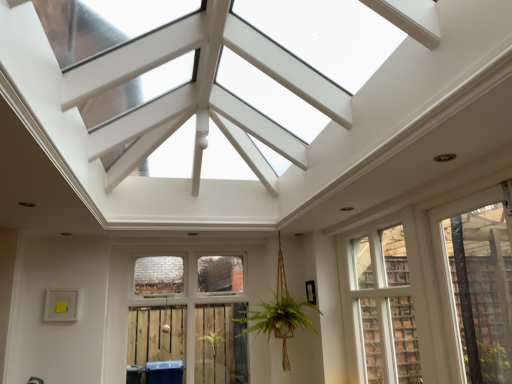
Question: Could you tell me if clear glass window at center, which appears as the third window when viewed from the right, is turned towards white wood window at center, marked as the second window in a left-to-right arrangement?

Choices:
 (A) yes
 (B) no

Answer: (B)

Question: Is the depth of clear glass window at center, arranged as the first window when viewed from the left, greater than that of white wood window at center, the second window from the right?

Choices:
 (A) no
 (B) yes

Answer: (B)

Question: Considering the relative positions of clear glass window at center, which appears as the third window when viewed from the right, and white wood window at center, the second window from the right, in the image provided, is clear glass window at center, which appears as the third window when viewed from the right, to the left of white wood window at center, the second window from the right, from the viewer's perspective?

Choices:
 (A) yes
 (B) no

Answer: (A)

Question: Is clear glass window at center, arranged as the first window when viewed from the left, looking in the opposite direction of white wood window at center, marked as the second window in a left-to-right arrangement?

Choices:
 (A) no
 (B) yes

Answer: (A)

Question: Can you confirm if clear glass window at center, arranged as the first window when viewed from the left, is smaller than white wood window at center, marked as the second window in a left-to-right arrangement?

Choices:
 (A) yes
 (B) no

Answer: (B)

Question: From the image's perspective, relative to clear glass window at center, arranged as the first window when viewed from the left, is white wood window at center, the second window from the right, above or below?

Choices:
 (A) below
 (B) above

Answer: (B)

Question: From a real-world perspective, is white wood window at center, marked as the second window in a left-to-right arrangement, positioned above or below clear glass window at center, which appears as the third window when viewed from the right?

Choices:
 (A) above
 (B) below

Answer: (A)

Question: Considering the positions of white wood window at center, marked as the second window in a left-to-right arrangement, and clear glass window at center, arranged as the first window when viewed from the left, in the image, is white wood window at center, marked as the second window in a left-to-right arrangement, taller or shorter than clear glass window at center, arranged as the first window when viewed from the left,?

Choices:
 (A) short
 (B) tall

Answer: (A)

Question: Is white wood window at center, the second window from the right, in front of or behind clear glass window at center, which appears as the third window when viewed from the right, in the image?

Choices:
 (A) front
 (B) behind

Answer: (A)

Question: Based on their positions, is clear glass window at center, arranged as the first window when viewed from the left, located to the left or right of white wood window at center, the second window from the right?

Choices:
 (A) left
 (B) right

Answer: (A)

Question: Is clear glass window at center, arranged as the first window when viewed from the left, situated inside white wood window at center, the second window from the right, or outside?

Choices:
 (A) inside
 (B) outside

Answer: (B)

Question: In terms of width, does clear glass window at center, arranged as the first window when viewed from the left, look wider or thinner when compared to white wood window at center, the second window from the right?

Choices:
 (A) thin
 (B) wide

Answer: (B)

Question: From their relative heights in the image, would you say clear glass window at center, which appears as the third window when viewed from the right, is taller or shorter than white wood window at center, marked as the second window in a left-to-right arrangement?

Choices:
 (A) short
 (B) tall

Answer: (B)

Question: Is point (493, 195) closer or farther from the camera than point (238, 281)?

Choices:
 (A) closer
 (B) farther

Answer: (A)

Question: From a real-world perspective, is transparent plastic window at right, the first window positioned from the right, above or below clear glass window at center, arranged as the first window when viewed from the left?

Choices:
 (A) below
 (B) above

Answer: (B)